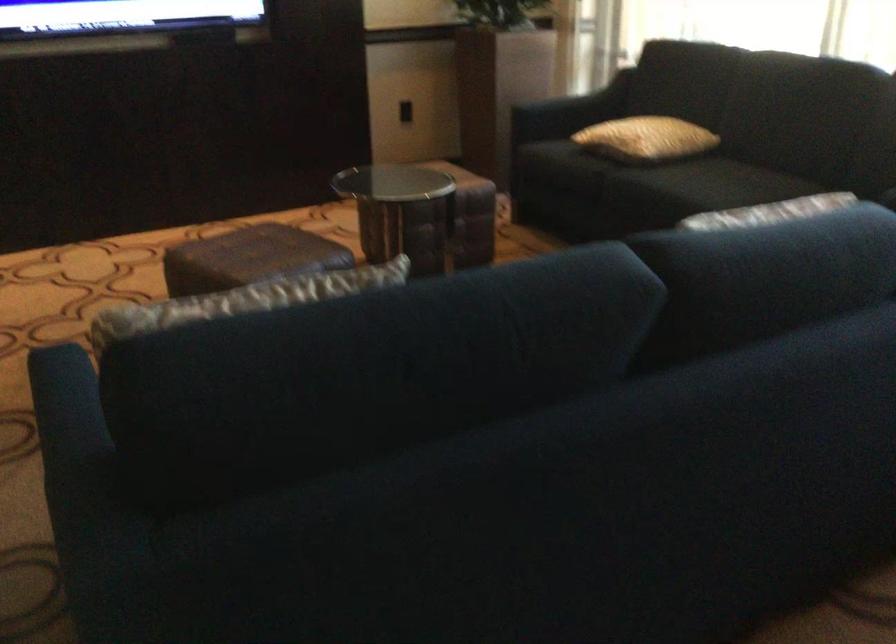
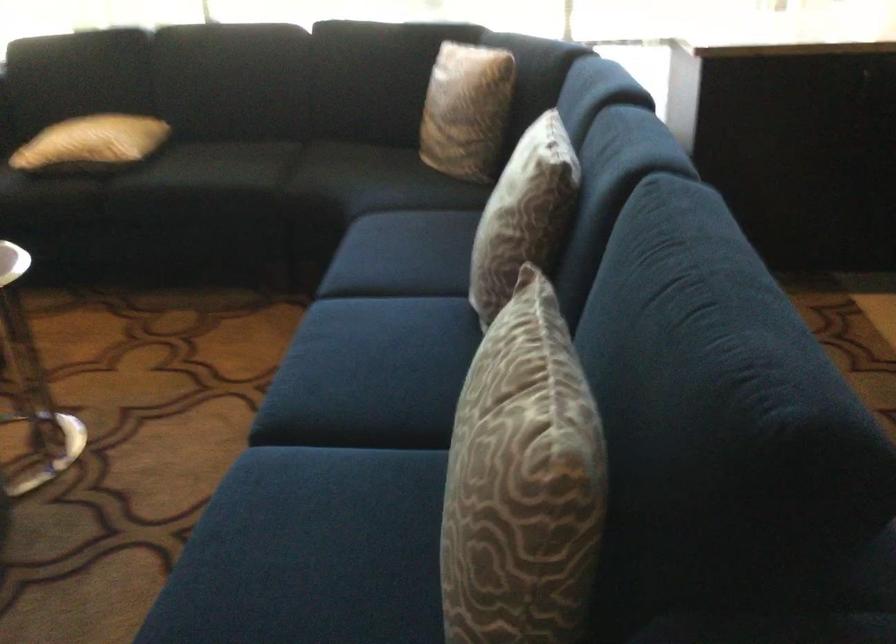
The point at (625, 133) is marked in the first image. Where is the corresponding point in the second image?

(91, 142)